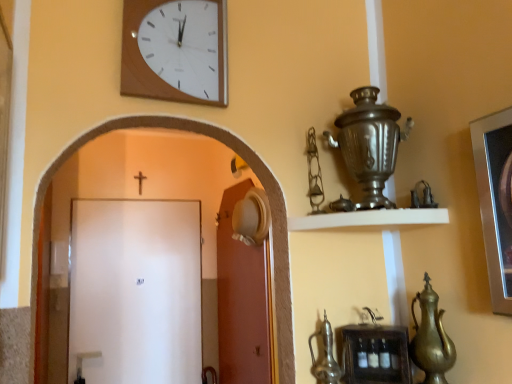
This screenshot has width=512, height=384. Find the location of `free location above white matte door at center, the 1th door positioned from the left (from a real-world perspective)`. free location above white matte door at center, the 1th door positioned from the left (from a real-world perspective) is located at coordinates (140, 202).